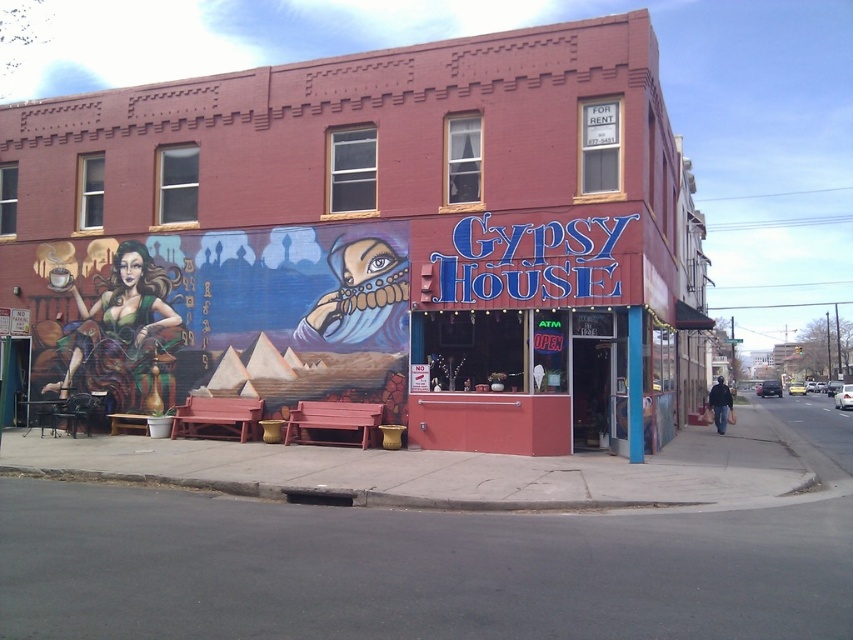
Which is more to the right, matte brick building at center or matte black woman at left?

matte brick building at center

Is matte brick building at center above matte black woman at left?

Yes, matte brick building at center is above matte black woman at left.

Is point (602, 84) farther from viewer compared to point (334, 236)?

No, (602, 84) is closer to viewer.

I want to click on matte brick building at center, so tap(373, 241).

Who is taller, matte black woman at left or matte pink counter at center?

With more height is matte black woman at left.

Does matte black woman at left have a lesser width compared to matte pink counter at center?

In fact, matte black woman at left might be wider than matte pink counter at center.

Consider the image. Measure the distance between matte black woman at left and camera.

They are 15.73 meters apart.

Image resolution: width=853 pixels, height=640 pixels. I want to click on matte black woman at left, so click(x=223, y=316).

Is point (643, 204) positioned behind point (451, 436)?

That is False.

Can you confirm if matte brick building at center is positioned to the right of matte pink counter at center?

Yes, matte brick building at center is to the right of matte pink counter at center.

This screenshot has width=853, height=640. I want to click on matte brick building at center, so click(373, 241).